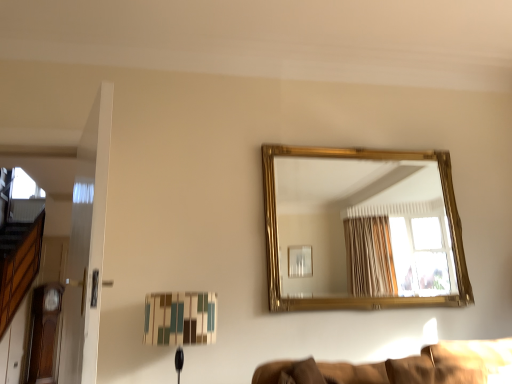
Question: Can we say brown fabric couch at lower right lies outside matte plastic table lamp at lower center?

Choices:
 (A) no
 (B) yes

Answer: (B)

Question: Considering the relative sizes of brown fabric couch at lower right and matte plastic table lamp at lower center in the image provided, is brown fabric couch at lower right shorter than matte plastic table lamp at lower center?

Choices:
 (A) yes
 (B) no

Answer: (A)

Question: Does brown fabric couch at lower right have a greater width compared to matte plastic table lamp at lower center?

Choices:
 (A) yes
 (B) no

Answer: (A)

Question: From the image's perspective, is brown fabric couch at lower right over matte plastic table lamp at lower center?

Choices:
 (A) yes
 (B) no

Answer: (B)

Question: Is brown fabric couch at lower right far from matte plastic table lamp at lower center?

Choices:
 (A) yes
 (B) no

Answer: (B)

Question: Is brown fabric couch at lower right facing away from matte plastic table lamp at lower center?

Choices:
 (A) yes
 (B) no

Answer: (B)

Question: Is gold/gilded mirror at upper center shorter than brown fabric couch at lower right?

Choices:
 (A) yes
 (B) no

Answer: (B)

Question: Considering the relative sizes of gold/gilded mirror at upper center and brown fabric couch at lower right in the image provided, is gold/gilded mirror at upper center bigger than brown fabric couch at lower right?

Choices:
 (A) yes
 (B) no

Answer: (A)

Question: Is gold/gilded mirror at upper center in contact with brown fabric couch at lower right?

Choices:
 (A) yes
 (B) no

Answer: (B)

Question: Does gold/gilded mirror at upper center appear on the left side of brown fabric couch at lower right?

Choices:
 (A) yes
 (B) no

Answer: (B)

Question: From a real-world perspective, is gold/gilded mirror at upper center below brown fabric couch at lower right?

Choices:
 (A) yes
 (B) no

Answer: (B)

Question: From the image's perspective, does gold/gilded mirror at upper center appear higher than brown fabric couch at lower right?

Choices:
 (A) no
 (B) yes

Answer: (B)

Question: Does matte plastic table lamp at lower center have a lesser height compared to brown fabric couch at lower right?

Choices:
 (A) yes
 (B) no

Answer: (B)